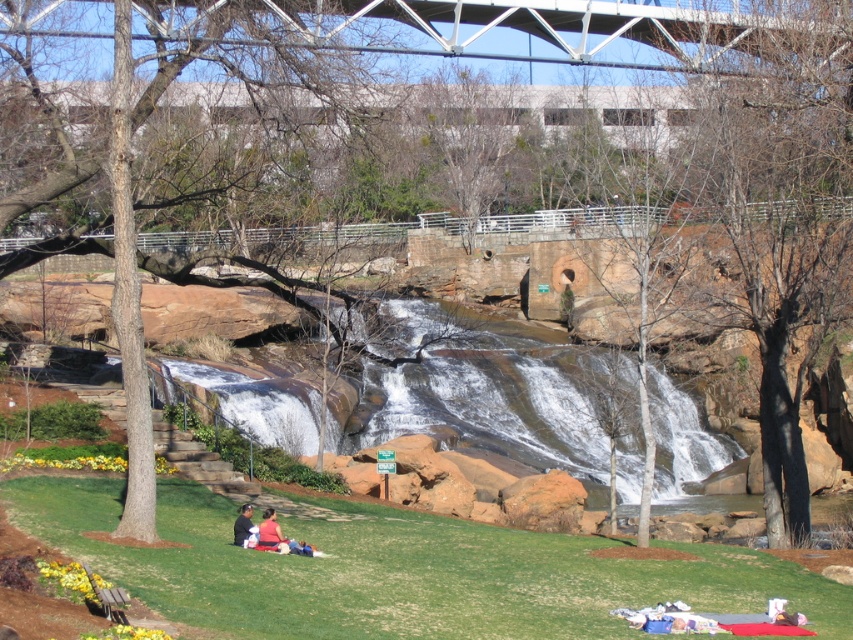
Measure the distance between matte pink shirt at lower center and dark brown leather jacket at lower center.

The distance of matte pink shirt at lower center from dark brown leather jacket at lower center is 13.89 inches.

Measure the distance from matte pink shirt at lower center to dark brown leather jacket at lower center.

matte pink shirt at lower center is 35.28 centimeters from dark brown leather jacket at lower center.

Which is behind, point (270, 532) or point (241, 513)?

Point (241, 513)

The image size is (853, 640). What are the coordinates of `matte pink shirt at lower center` in the screenshot? It's located at (271, 532).

Who is lower down, green grass at lower center or white metallic bridge at upper center?

green grass at lower center is lower down.

Can you confirm if green grass at lower center is smaller than white metallic bridge at upper center?

Yes.

Who is more forward, (525, 566) or (524, 8)?

Point (525, 566)

Image resolution: width=853 pixels, height=640 pixels. What are the coordinates of `green grass at lower center` in the screenshot? It's located at (399, 572).

Locate an element on the screen. green grass at lower center is located at coordinates (399, 572).

Who is more distant from viewer, (171, 529) or (561, 378)?

The point (561, 378) is behind.

The image size is (853, 640). In order to click on green grass at lower center in this screenshot , I will do `click(399, 572)`.